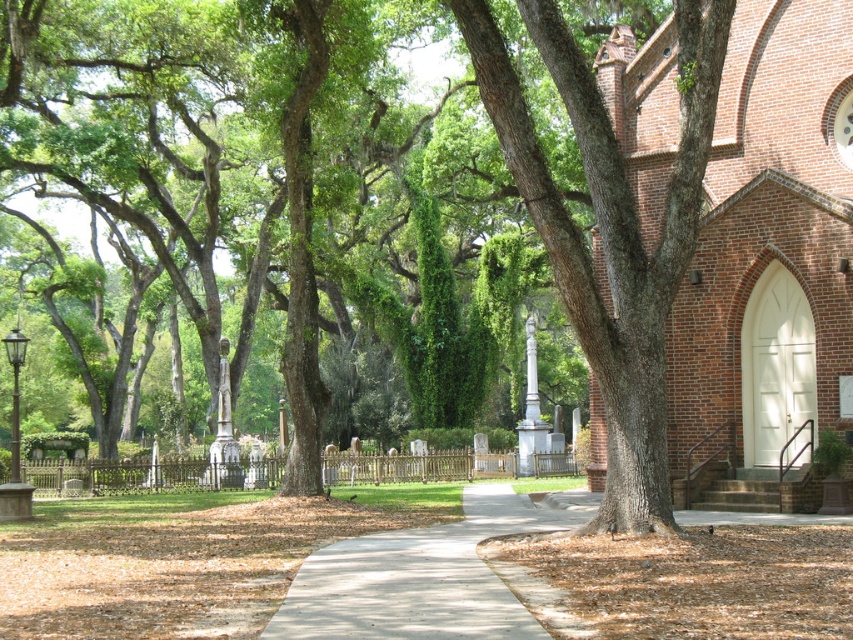
You are standing at the point closer to the camera in the scene. Which point are you at, point (590, 490) or point (444, 624)?

You are at point (590, 490) because it is further to the camera than point (444, 624).

Consider the image. You are a visitor walking along the paved pathway in the cemetery. You want to reach the brick church at center. Which direction should you walk relative to the smooth brown bark at center?

You should walk towards the brick church at center, which is closer to you than the smooth brown bark at center, so you need to move forward in the direction of the brick church at center.

You are a visitor at the brick church at center and want to walk to the gray concrete sidewalk at center. Which direction should you face to walk towards it?

The gray concrete sidewalk at center is behind the brick church at center, so you should face away from the brick church at center to reach the gray concrete sidewalk at center.